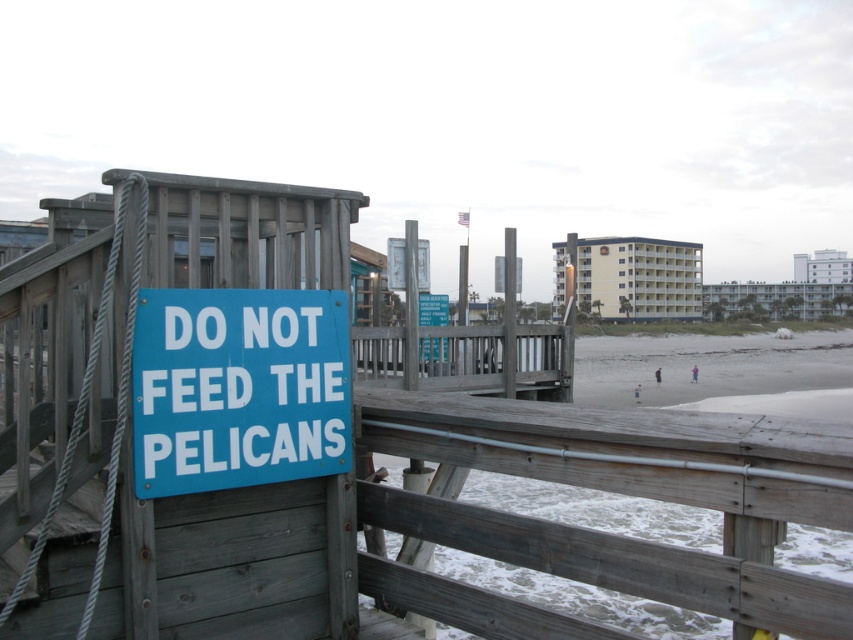
You are standing at the starting point of the boardwalk and want to reach the sandy beach. There is a gray wooden rail at center. Can you walk directly towards the point at coordinates point (627, 493) to get to the beach?

The point at coordinates point (627, 493) is on the gray wooden rail at center, so walking directly towards it would lead you to the rail, not the beach.

You are standing on the boardwalk and need to reach the beach. The gray wooden rail at center is in your way. Can you step over it?

The gray wooden rail at center is located at point (627,493), which is part of the boardwalk structure. Since rails are typically low enough to step over, you can step over the gray wooden rail at center to reach the beach.